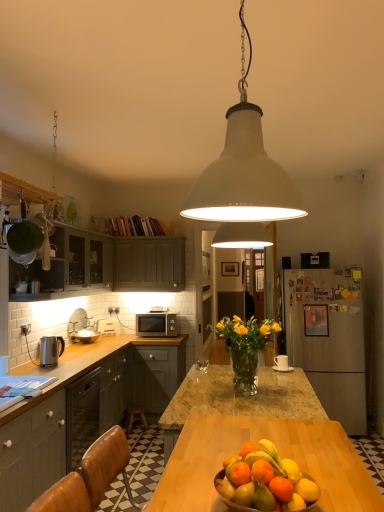
Question: From a real-world perspective, is orange matte fruit at center above or below matte gray cabinets at upper left, the first cabinetry in the top-to-bottom sequence?

Choices:
 (A) below
 (B) above

Answer: (A)

Question: Is orange matte fruit at center taller or shorter than matte gray cabinets at upper left, the fourth cabinetry positioned from the bottom?

Choices:
 (A) short
 (B) tall

Answer: (A)

Question: Which of these objects is positioned closest to the white matte pendant light at center?

Choices:
 (A) orange matte citrus at center, the 2th citrus fruit in the back-to-front sequence
 (B) matte gray cabinets at left, which is the first cabinetry in bottom-to-top order
 (C) satin silver microwave at center
 (D) polished stainless steel kettle at left, acting as the first appliance starting from the front
 (E) translucent glass vase at center

Answer: (A)

Question: Which of these objects is positioned farthest from the satin grey cabinets at left, marked as the third cabinetry in a top-to-bottom arrangement?

Choices:
 (A) matte gray cabinets at left, which is the first cabinetry in bottom-to-top order
 (B) wooden stool at lower center
 (C) orange matte fruit at center
 (D) matte gray cabinet at center, acting as the 3th cabinetry starting from the bottom
 (E) orange matte citrus at center, which is counted as the 1th citrus fruit, starting from the back

Answer: (E)